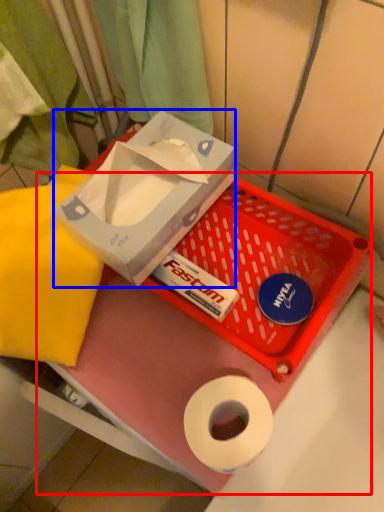
Question: Among these objects, which one is nearest to the camera, box (highlighted by a red box) or box (highlighted by a blue box)?

Choices:
 (A) box
 (B) box

Answer: (B)